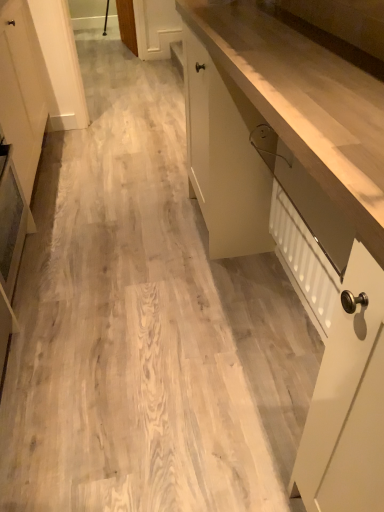
Describe the element at coordinates (300, 214) in the screenshot. This screenshot has height=512, width=384. I see `white matte cabinet at right` at that location.

This screenshot has width=384, height=512. What are the coordinates of `white matte cabinet at right` in the screenshot? It's located at (300, 214).

Where is `white matte cabinet at right`? white matte cabinet at right is located at coordinates (300, 214).